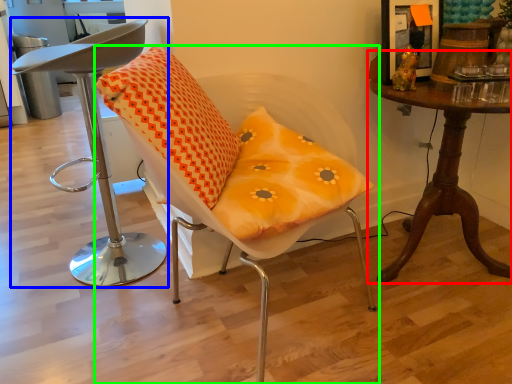
Question: Which object is positioned closest to table (highlighted by a red box)? Select from chair (highlighted by a blue box) and chair (highlighted by a green box).

Choices:
 (A) chair
 (B) chair

Answer: (B)